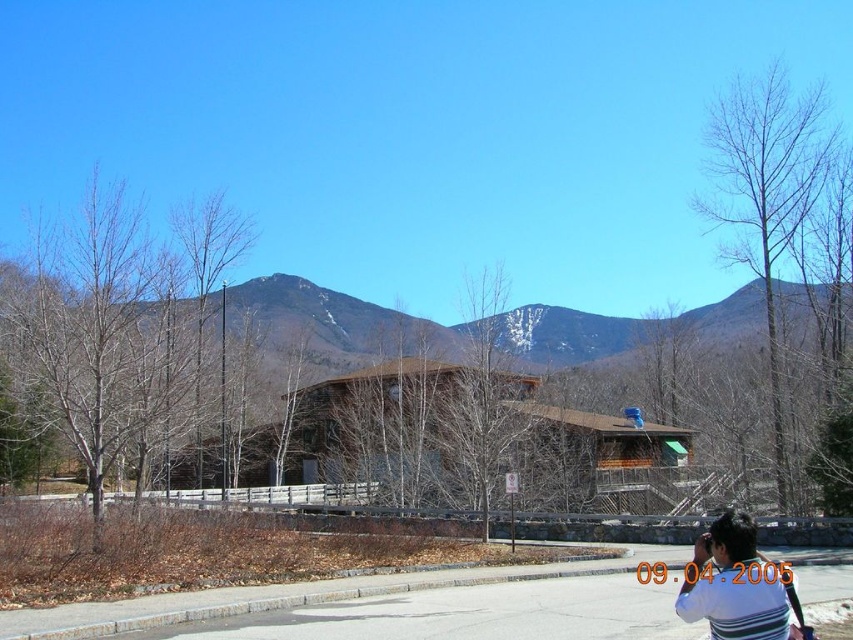
Who is positioned more to the left, bare branches at left or bare wood tree at right?

Positioned to the left is bare branches at left.

Is bare branches at left taller than bare wood tree at right?

No.

Identify the location of bare branches at left. (103, 342).

Can you confirm if bare wood tree at right is wider than white striped shirt at lower right?

In fact, bare wood tree at right might be narrower than white striped shirt at lower right.

Between bare wood tree at right and white striped shirt at lower right, which one appears on the right side from the viewer's perspective?

From the viewer's perspective, bare wood tree at right appears more on the right side.

Which is in front, point (814, 198) or point (714, 628)?

Point (714, 628) is more forward.

At what (x,y) coordinates should I click in order to perform the action: click on bare wood tree at right. Please return your answer as a coordinate pair (x, y). This screenshot has width=853, height=640. Looking at the image, I should click on (764, 193).

Measure the distance between bare branches at left and camera.

bare branches at left is 15.79 meters from camera.

In the scene shown: Can you confirm if bare branches at left is taller than snowy brown mountain at center?

Yes.

At what (x,y) coordinates should I click in order to perform the action: click on bare branches at left. Please return your answer as a coordinate pair (x, y). Looking at the image, I should click on (103, 342).